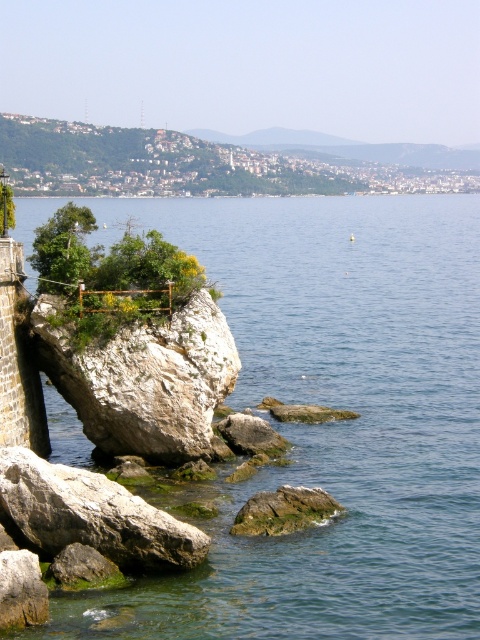
You are standing on the viewing platform near the gray rough rock at lower left and want to walk to the green mossy rock at lower center. Which direction should you move to reach it?

You should move to the right to reach the green mossy rock at lower center because the gray rough rock at lower left is to the left of it.

You are a hiker standing on the viewing platform near the gray rough rock at lower left. You want to get to the clear blue water at center. Which direction should you move to reach it?

The clear blue water at center is above the gray rough rock at lower left, so you should move upward to reach it.